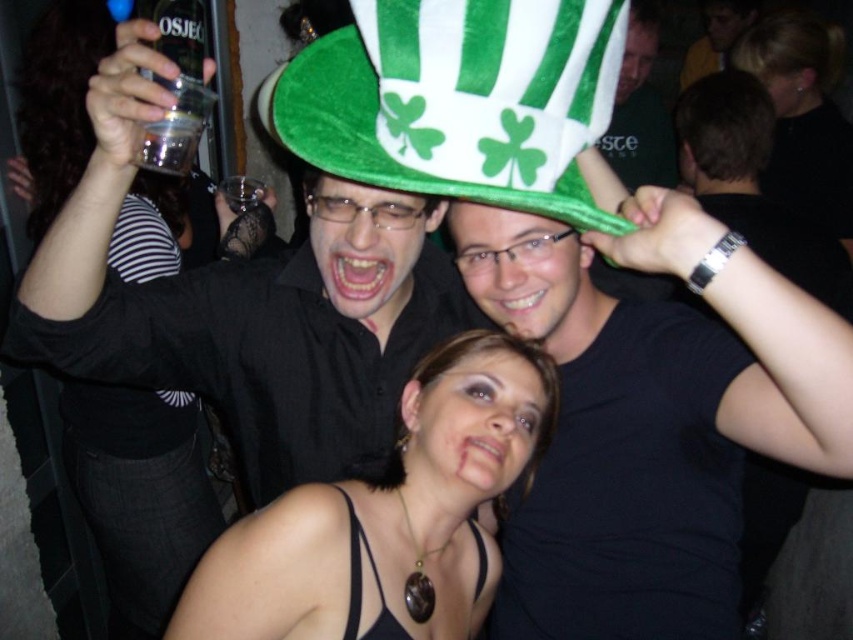
Can you confirm if velvet green hat at center is shorter than smooth black hair at upper right?

Yes, velvet green hat at center is shorter than smooth black hair at upper right.

Does velvet green hat at center come behind smooth black hair at upper right?

No, it is in front of smooth black hair at upper right.

Between point (518, 198) and point (769, 67), which one is positioned behind?

Point (769, 67)

Identify the location of velvet green hat at center. (461, 99).

Is black matte shirt at upper center taller than transparent plastic bottle at upper left?

Yes.

Who is lower down, black matte shirt at upper center or transparent plastic bottle at upper left?

transparent plastic bottle at upper left

Where is `black matte shirt at upper center`? black matte shirt at upper center is located at coordinates (640, 109).

At what (x,y) coordinates should I click in order to perform the action: click on black matte shirt at upper center. Please return your answer as a coordinate pair (x, y). Looking at the image, I should click on (640, 109).

Is felt green hat at upper center further to the viewer compared to matte black shirt at upper center?

That is False.

Does point (289, 300) lie in front of point (755, 3)?

Yes.

The height and width of the screenshot is (640, 853). I want to click on felt green hat at upper center, so click(247, 304).